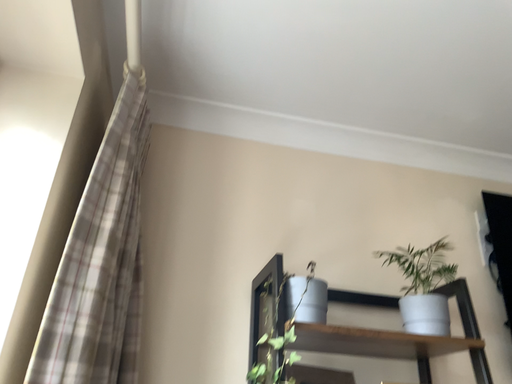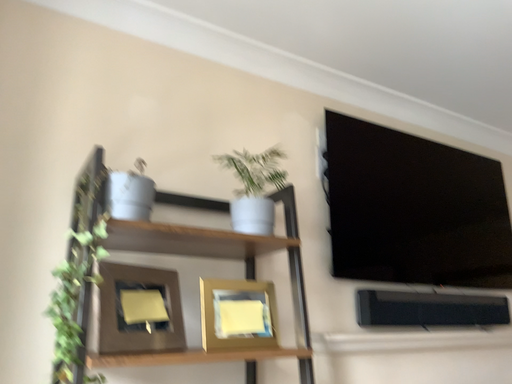
Question: How did the camera likely rotate when shooting the video?

Choices:
 (A) rotated left
 (B) rotated right

Answer: (B)